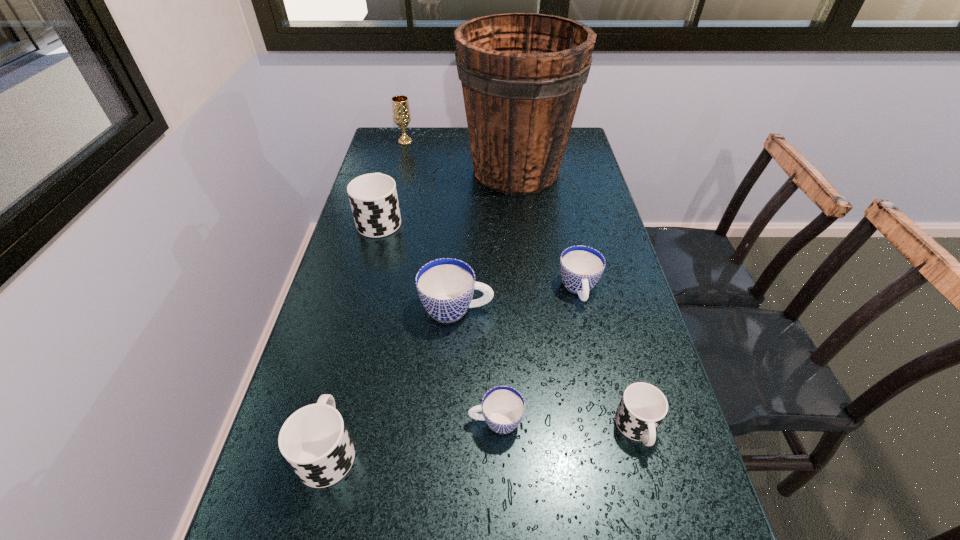
Find the location of a particular element. bucket is located at coordinates 522,74.

Where is `the seventh shortest object`? The width and height of the screenshot is (960, 540). the seventh shortest object is located at coordinates (400, 105).

Where is `the farthest black cup`? the farthest black cup is located at coordinates (373, 197).

Image resolution: width=960 pixels, height=540 pixels. What are the coordinates of `the biggest black cup` in the screenshot? It's located at (373, 197).

Locate an element on the screen. the biggest blue cup is located at coordinates (445, 286).

Where is `the second smallest black cup`? This screenshot has width=960, height=540. the second smallest black cup is located at coordinates (314, 440).

Locate an element on the screen. The width and height of the screenshot is (960, 540). the rightmost blue cup is located at coordinates (581, 267).

The image size is (960, 540). Find the location of `the rightmost black cup`. the rightmost black cup is located at coordinates (643, 407).

This screenshot has width=960, height=540. I want to click on the nearest blue cup, so click(503, 407).

Find the location of `the shortest object`. the shortest object is located at coordinates (503, 407).